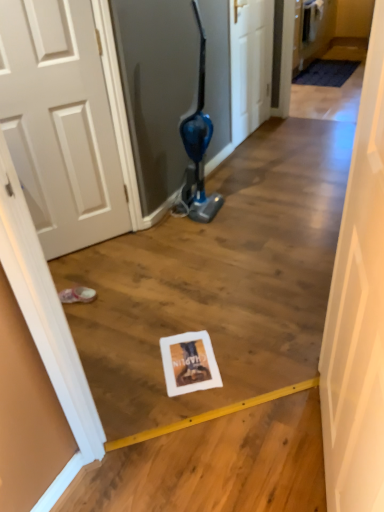
Question: Is white matte door at center, which is the second door from top to bottom, not within pink fabric footwear at lower left?

Choices:
 (A) yes
 (B) no

Answer: (A)

Question: Is white matte door at center, which is the second door from top to bottom, surrounding pink fabric footwear at lower left?

Choices:
 (A) yes
 (B) no

Answer: (B)

Question: Could you tell me if white matte door at center, the first door in the bottom-to-top sequence, is turned towards pink fabric footwear at lower left?

Choices:
 (A) no
 (B) yes

Answer: (B)

Question: Is the depth of white matte door at center, the second door from the back, greater than that of pink fabric footwear at lower left?

Choices:
 (A) no
 (B) yes

Answer: (A)

Question: Can you confirm if white matte door at center, which ranks as the first door in front-to-back order, is bigger than pink fabric footwear at lower left?

Choices:
 (A) yes
 (B) no

Answer: (A)

Question: Considering the relative sizes of white matte door at center, which ranks as the first door in front-to-back order, and pink fabric footwear at lower left in the image provided, is white matte door at center, which ranks as the first door in front-to-back order, thinner than pink fabric footwear at lower left?

Choices:
 (A) yes
 (B) no

Answer: (A)

Question: Would you say white wood door at center, the second door when ordered from bottom to top, is outside white matte door at center, the first door in the bottom-to-top sequence?

Choices:
 (A) yes
 (B) no

Answer: (A)

Question: Is white wood door at center, placed as the first door when sorted from back to front, surrounding white matte door at center, which ranks as the first door in front-to-back order?

Choices:
 (A) no
 (B) yes

Answer: (A)

Question: From the image's perspective, is white wood door at center, which appears as the 2th door when viewed from the front, over white matte door at center, the first door in the bottom-to-top sequence?

Choices:
 (A) no
 (B) yes

Answer: (B)

Question: Does white wood door at center, acting as the 1th door starting from the top, have a greater height compared to white matte door at center, which ranks as the first door in front-to-back order?

Choices:
 (A) yes
 (B) no

Answer: (B)

Question: Is white matte door at center, the second door from the back, at the back of white wood door at center, which appears as the 2th door when viewed from the front?

Choices:
 (A) no
 (B) yes

Answer: (A)

Question: Considering the relative sizes of white wood door at center, which appears as the 2th door when viewed from the front, and white matte door at center, which ranks as the first door in front-to-back order, in the image provided, is white wood door at center, which appears as the 2th door when viewed from the front, bigger than white matte door at center, which ranks as the first door in front-to-back order,?

Choices:
 (A) no
 (B) yes

Answer: (A)

Question: Is white matte door at center, the second door from the back, shorter than white wood door at center, which appears as the 2th door when viewed from the front?

Choices:
 (A) yes
 (B) no

Answer: (B)